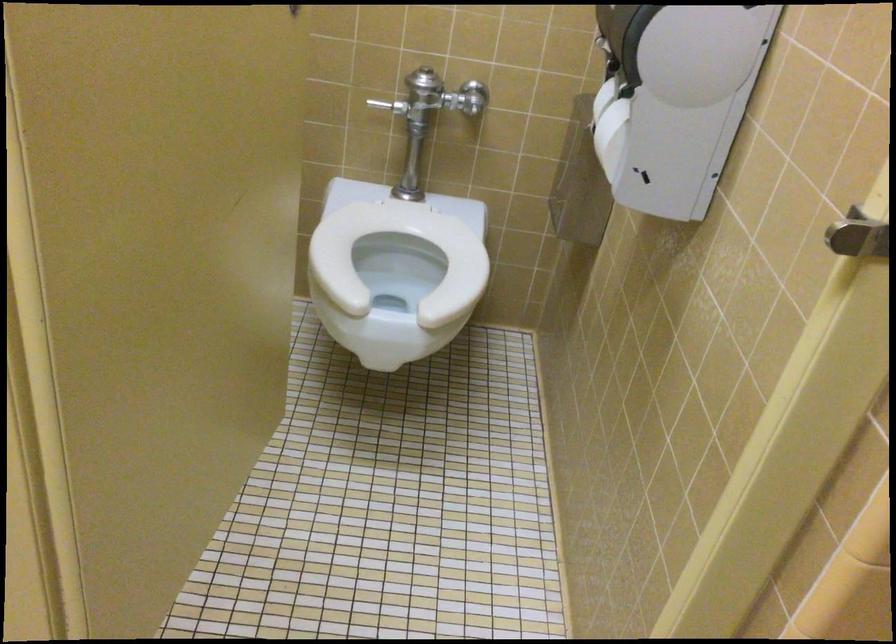
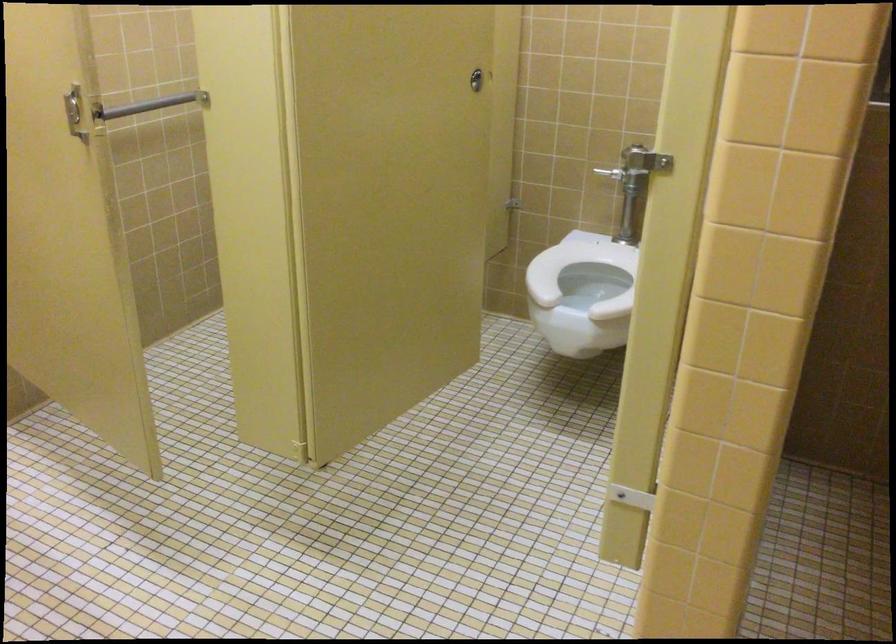
The point at [362,243] is marked in the first image. Where is the corresponding point in the second image?

(578, 268)